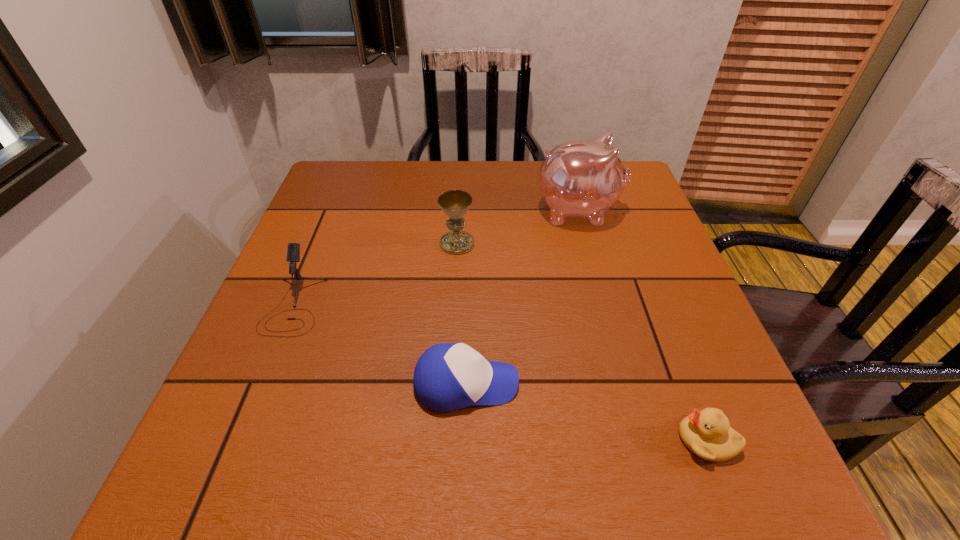
You are a GUI agent. You are given a task and a screenshot of the screen. Output one action in this format:
    pyautogui.click(x=<x>, y=<y>)
    Task: Click on the vacant area between the duckling and the tallest object
    
    Given the screenshot: What is the action you would take?
    pyautogui.click(x=642, y=325)

Identify the location of unoccupied area between the tallest object and the fourth shortest object. The height and width of the screenshot is (540, 960). (517, 227).

Image resolution: width=960 pixels, height=540 pixels. Identify the location of free space between the tallest object and the duckling. (642, 325).

You are a GUI agent. You are given a task and a screenshot of the screen. Output one action in this format:
    pyautogui.click(x=<x>, y=<y>)
    Task: Click on the empty location between the tallest object and the leftmost object
    Image resolution: width=960 pixels, height=540 pixels.
    Given the screenshot: What is the action you would take?
    pyautogui.click(x=436, y=258)

Image resolution: width=960 pixels, height=540 pixels. Identify the location of free spot between the chalice and the duckling. (582, 342).

Locate an element on the screen. Image resolution: width=960 pixels, height=540 pixels. empty space between the piggy bank and the baseball cap is located at coordinates 522,298.

Identify the location of object that can be found as the fourth closest to the second tallest object. This screenshot has width=960, height=540. (707, 433).

Where is `the second closest object to the baseball cap`? the second closest object to the baseball cap is located at coordinates (707, 433).

The width and height of the screenshot is (960, 540). Find the location of `vacant space that satisfies the following two spatial constraints: 1. on the back side of the chalice; 2. on the front facing side of the tallest object`. vacant space that satisfies the following two spatial constraints: 1. on the back side of the chalice; 2. on the front facing side of the tallest object is located at coordinates (459, 211).

Where is `vacant region that satisfies the following two spatial constraints: 1. on the back side of the chalice; 2. on the front facing side of the tallest object`? The image size is (960, 540). vacant region that satisfies the following two spatial constraints: 1. on the back side of the chalice; 2. on the front facing side of the tallest object is located at coordinates (459, 211).